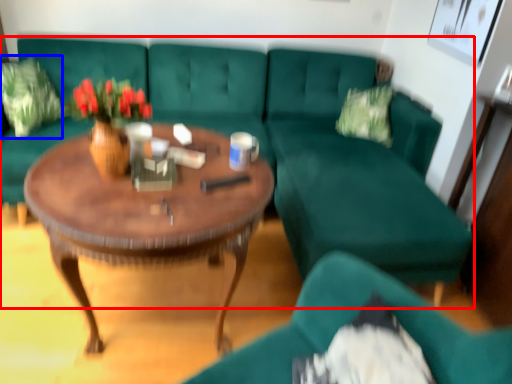
Question: Which object is closer to the camera taking this photo, studio couch (highlighted by a red box) or pillow (highlighted by a blue box)?

Choices:
 (A) studio couch
 (B) pillow

Answer: (A)